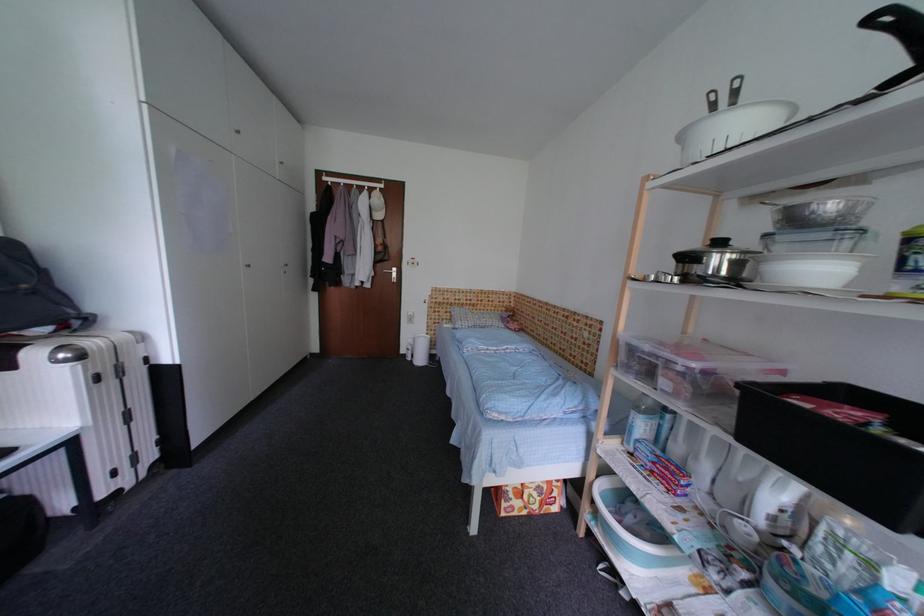
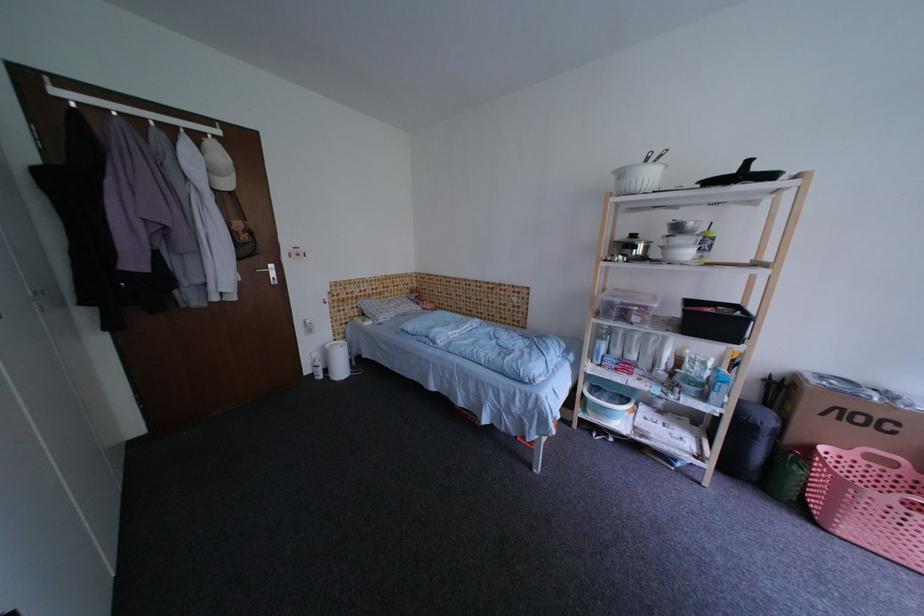
Where in the second image is the point corresponding to point (385, 201) from the first image?

(227, 158)